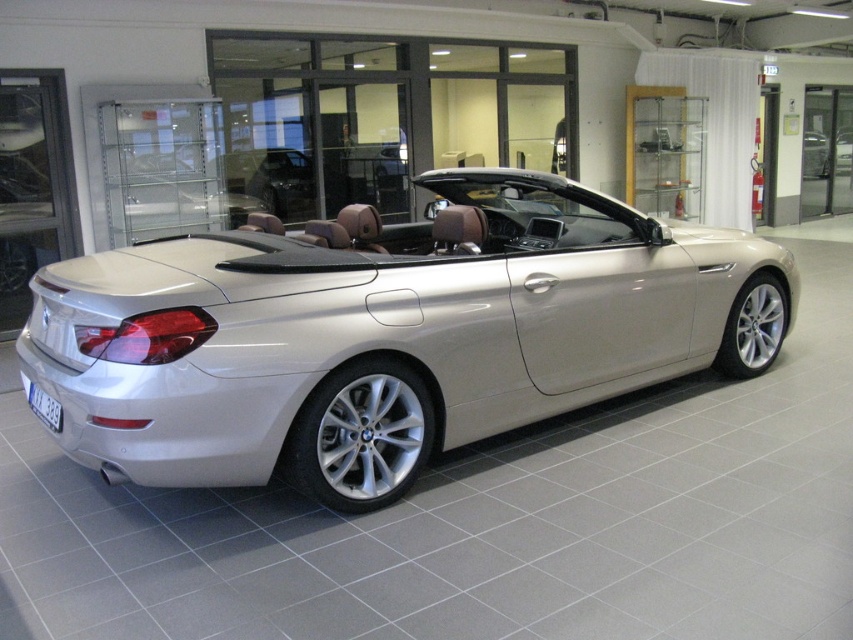
Question: Which point appears farthest from the camera in this image?

Choices:
 (A) (471, 416)
 (B) (54, 401)

Answer: (A)

Question: Which point appears farthest from the camera in this image?

Choices:
 (A) (369, 259)
 (B) (30, 387)

Answer: (B)

Question: In this image, where is satin silver convertible at center located relative to black plastic license plate at rear?

Choices:
 (A) left
 (B) right

Answer: (B)

Question: Does satin silver convertible at center have a larger size compared to black plastic license plate at rear?

Choices:
 (A) yes
 (B) no

Answer: (A)

Question: Can you confirm if satin silver convertible at center is smaller than black plastic license plate at rear?

Choices:
 (A) no
 (B) yes

Answer: (A)